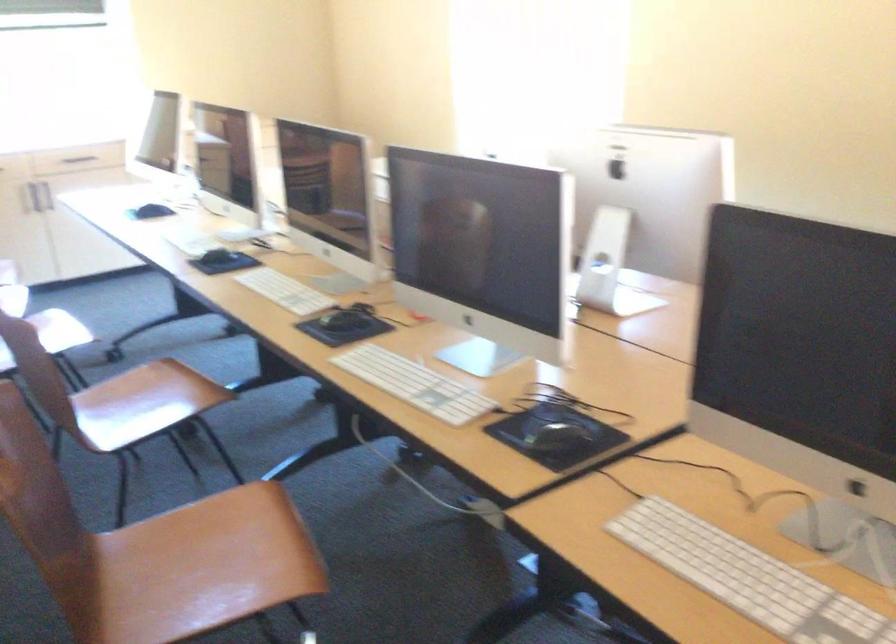
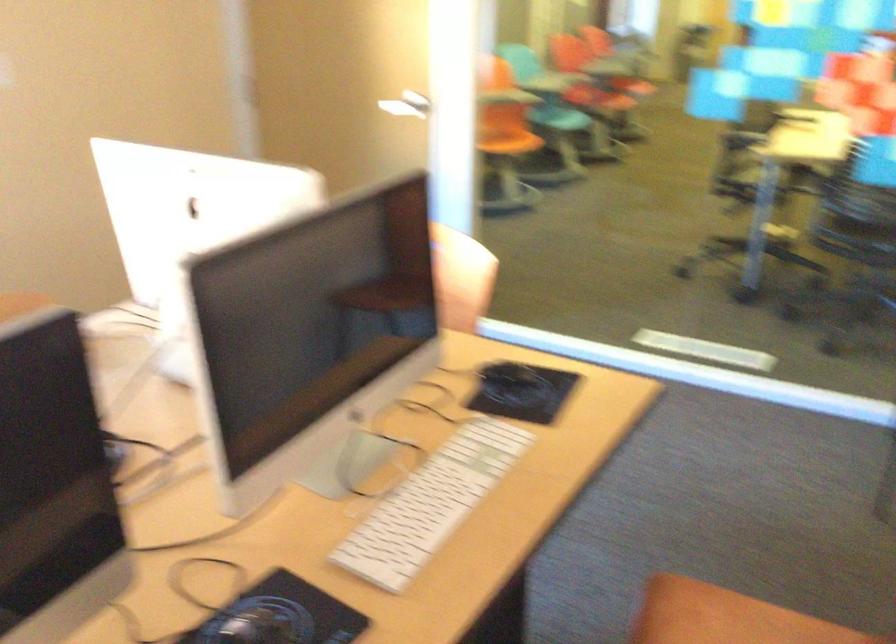
First-person continuous shooting, in which direction is the camera rotating?

The camera's rotation is toward right-down.